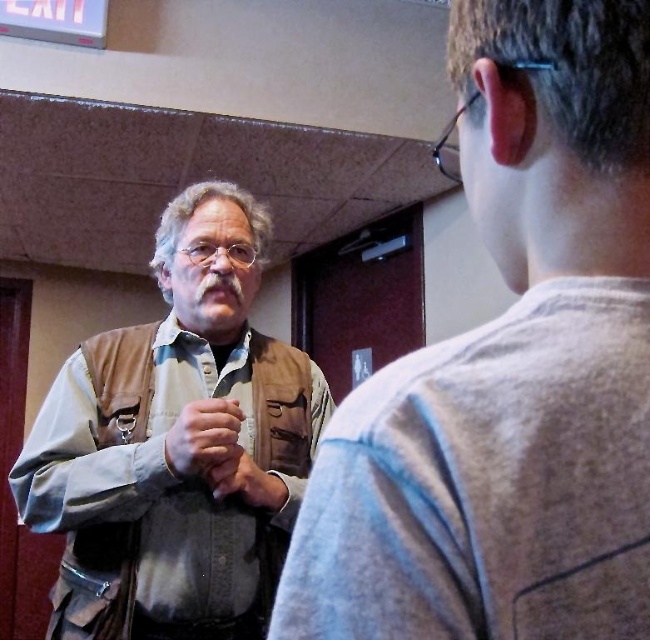
Is leather jacket at left wider than brown/camouflage vest at left?

Incorrect, leather jacket at left's width does not surpass brown/camouflage vest at left's.

From the picture: Can you confirm if leather jacket at left is positioned to the left of brown/camouflage vest at left?

No, leather jacket at left is not to the left of brown/camouflage vest at left.

Describe the element at coordinates (510, 369) in the screenshot. I see `leather jacket at left` at that location.

Identify the location of leather jacket at left. The height and width of the screenshot is (640, 650). (510, 369).

Who is shorter, leather jacket at left or matte brown leather hand at center?

With less height is matte brown leather hand at center.

Which of these two, leather jacket at left or matte brown leather hand at center, stands taller?

Standing taller between the two is leather jacket at left.

The image size is (650, 640). What do you see at coordinates (510, 369) in the screenshot? I see `leather jacket at left` at bounding box center [510, 369].

The image size is (650, 640). I want to click on leather jacket at left, so click(510, 369).

The image size is (650, 640). I want to click on brown/camouflage vest at left, so click(162, 444).

Between point (62, 592) and point (224, 444), which one is positioned in front?

Positioned in front is point (224, 444).

Locate an element on the screen. The height and width of the screenshot is (640, 650). brown/camouflage vest at left is located at coordinates (162, 444).